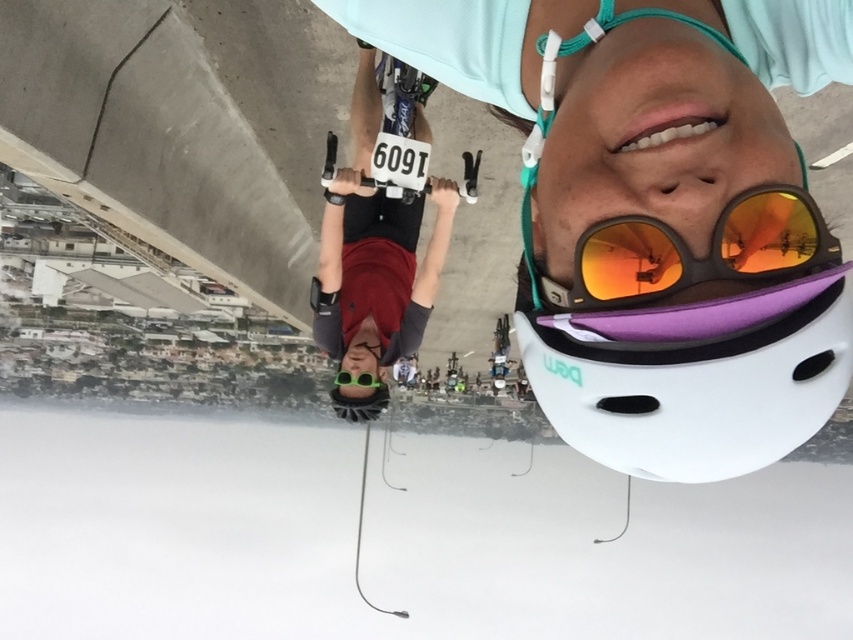
Question: Can you confirm if matte black helmet at upper center is smaller than matte orange lens goggles at upper center?

Choices:
 (A) yes
 (B) no

Answer: (B)

Question: Is matte black helmet at upper center further to the viewer compared to green matte/glossy goggles at center?

Choices:
 (A) no
 (B) yes

Answer: (A)

Question: Which of the following is the farthest from the observer?

Choices:
 (A) (344, 376)
 (B) (408, 320)
 (C) (641, 300)

Answer: (B)

Question: Which object is positioned farthest from the green matte/glossy goggles at center?

Choices:
 (A) matte black helmet at upper center
 (B) matte black helmet at center

Answer: (A)

Question: Which point is farther from the camera taking this photo?

Choices:
 (A) (357, 268)
 (B) (799, 266)
 (C) (849, 4)
 (D) (347, 385)

Answer: (A)

Question: Is matte black helmet at center smaller than matte orange lens goggles at upper center?

Choices:
 (A) no
 (B) yes

Answer: (A)